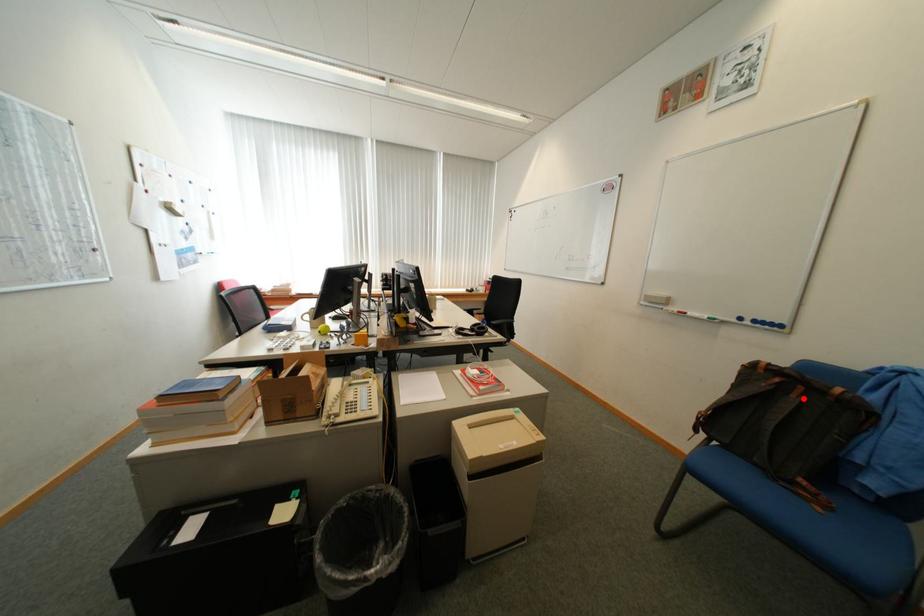
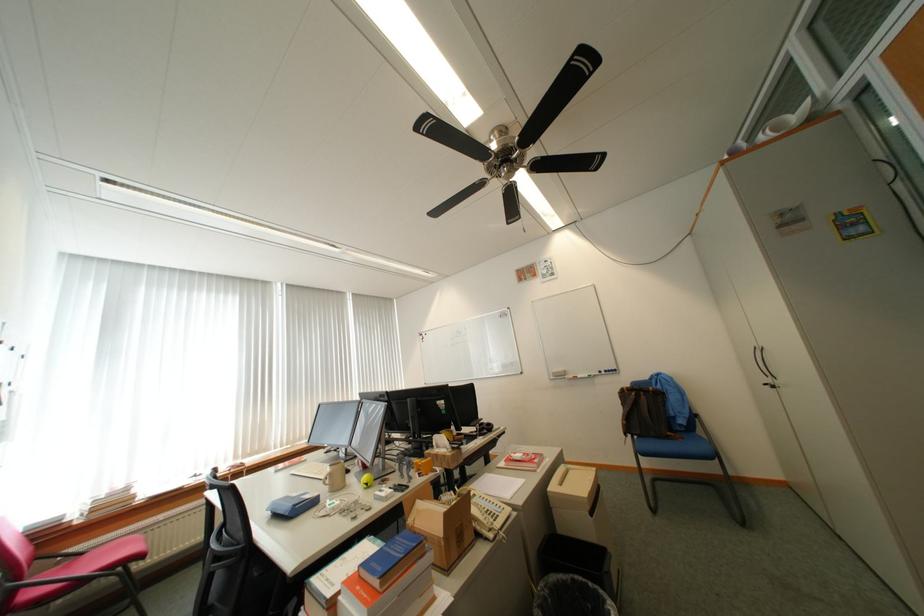
The point at the highlighted location is marked in the first image. Where is the corresponding point in the second image?

(652, 399)